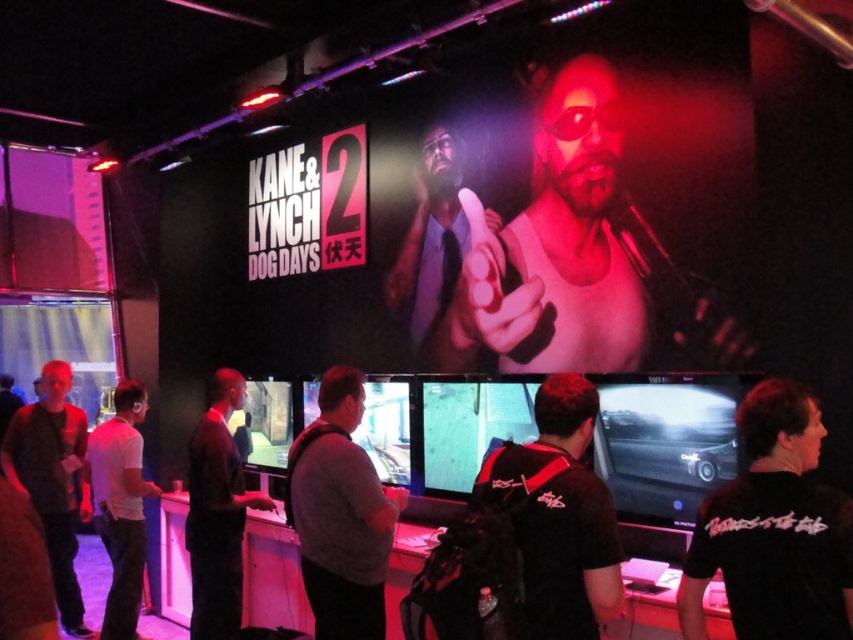
Question: Among these objects, which one is nearest to the camera?

Choices:
 (A) dark gray shirt at center
 (B) gray fabric shirt at center
 (C) matte white tank top at upper center
 (D) matte black tie at upper center

Answer: (B)

Question: Which point appears closest to the camera in this image?

Choices:
 (A) (375, 477)
 (B) (550, 465)
 (C) (432, 314)
 (D) (187, 481)

Answer: (B)

Question: Does dark gray shirt at center come behind white matte shirt at center?

Choices:
 (A) no
 (B) yes

Answer: (A)

Question: Does dark gray shirt at center appear on the right side of matte black tie at upper center?

Choices:
 (A) yes
 (B) no

Answer: (B)

Question: Is matte black tie at upper center wider than dark gray sweater at left?

Choices:
 (A) yes
 (B) no

Answer: (B)

Question: Which of the following is the farthest from the observer?

Choices:
 (A) matte black tie at upper center
 (B) matte white tank top at upper center
 (C) gray fabric shirt at center

Answer: (A)